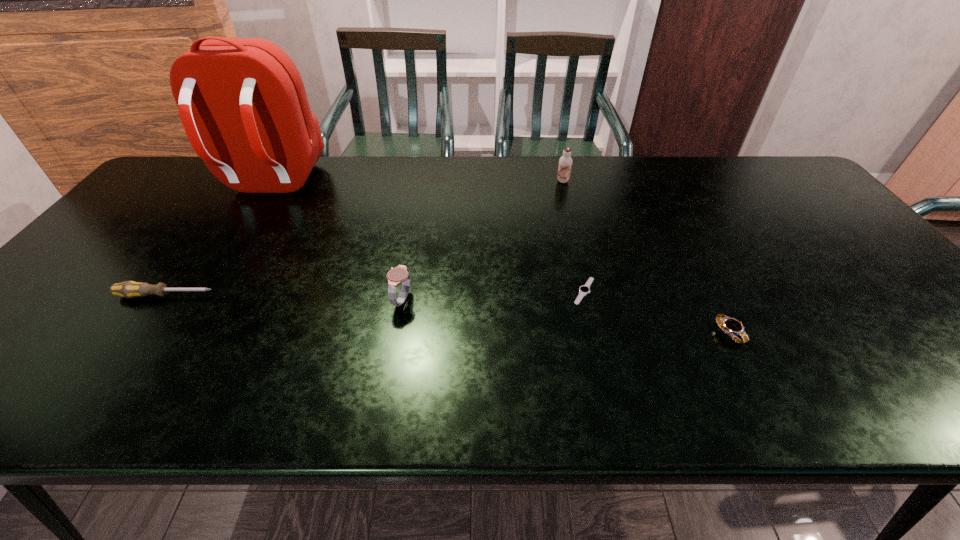
The image size is (960, 540). I want to click on backpack, so click(242, 102).

Image resolution: width=960 pixels, height=540 pixels. I want to click on chocolate milk, so click(565, 162).

Where is `the tallest watch`? The width and height of the screenshot is (960, 540). the tallest watch is located at coordinates (400, 274).

Locate an element on the screen. The height and width of the screenshot is (540, 960). the fourth object from right to left is located at coordinates (400, 274).

This screenshot has width=960, height=540. I want to click on screwdriver, so click(x=129, y=289).

You are a GUI agent. You are given a task and a screenshot of the screen. Output one action in this format:
    pyautogui.click(x=<x>, y=<y>)
    Task: Click on the second shortest watch
    
    Given the screenshot: What is the action you would take?
    pyautogui.click(x=730, y=326)

At what (x,y) coordinates should I click in order to perform the action: click on the second shortest object. Please return your answer as a coordinate pair (x, y). Image resolution: width=960 pixels, height=540 pixels. Looking at the image, I should click on (730, 326).

The height and width of the screenshot is (540, 960). I want to click on the shortest watch, so click(x=585, y=289).

Identify the location of the shortest object. The height and width of the screenshot is (540, 960). (585, 289).

Locate an element on the screen. Image resolution: width=960 pixels, height=540 pixels. vacant space located 0.190m on the strap side of the backpack is located at coordinates (227, 254).